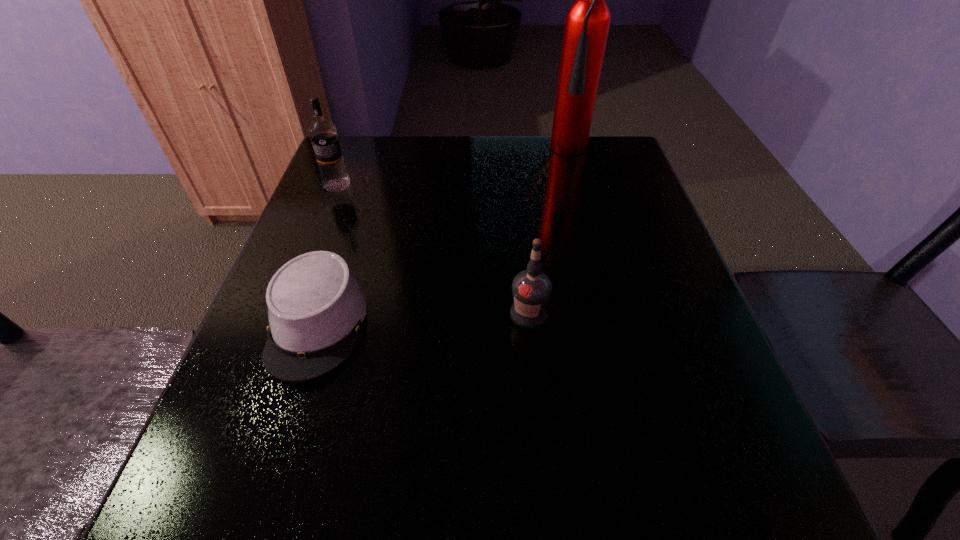
In the image, there is a desktop. Where is `vacant space at the right edge`? The image size is (960, 540). vacant space at the right edge is located at coordinates (634, 319).

In order to click on vacant space at the far right corner of the desktop in this screenshot , I will do `click(595, 176)`.

Locate an element on the screen. The height and width of the screenshot is (540, 960). vacant space that is in between the left vodka and the farthest object is located at coordinates (459, 168).

Where is `vacant space in between the shortest object and the right vodka`? vacant space in between the shortest object and the right vodka is located at coordinates (423, 320).

In order to click on free area in between the left vodka and the third tallest object in this screenshot , I will do `click(433, 249)`.

At what (x,y) coordinates should I click in order to perform the action: click on free point between the second farthest object and the right vodka. Please return your answer as a coordinate pair (x, y). Looking at the image, I should click on (433, 249).

Find the location of a particular element. free point between the fire extinguisher and the hat is located at coordinates (449, 238).

Locate an element on the screen. This screenshot has height=540, width=960. object that stands as the third closest to the fire extinguisher is located at coordinates (316, 306).

At what (x,y) coordinates should I click in order to perform the action: click on object that ranks as the second closest to the third object from left to right. Please return your answer as a coordinate pair (x, y). Looking at the image, I should click on (587, 22).